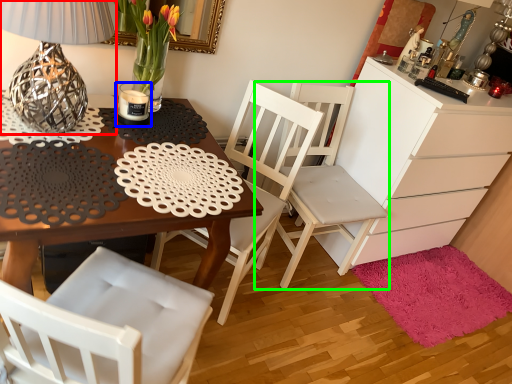
Question: Based on their relative distances, which object is farther from table lamp (highlighted by a red box)? Choose from candle holder (highlighted by a blue box) and chair (highlighted by a green box).

Choices:
 (A) candle holder
 (B) chair

Answer: (B)